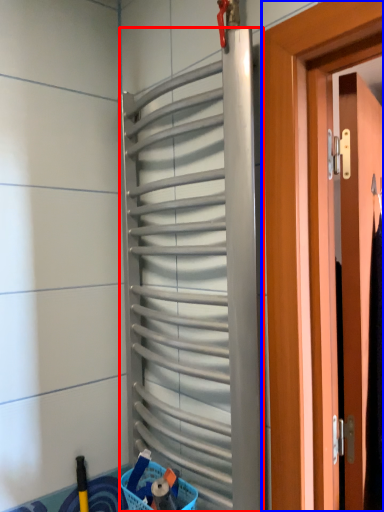
Question: Among these objects, which one is farthest to the camera, shutter (highlighted by a red box) or door (highlighted by a blue box)?

Choices:
 (A) shutter
 (B) door

Answer: (B)